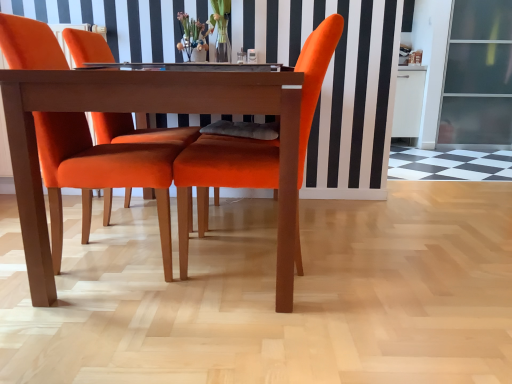
Question: Considering the relative positions of transparent glass screen door at right and translucent glass vase at center in the image provided, is transparent glass screen door at right to the right of translucent glass vase at center from the viewer's perspective?

Choices:
 (A) no
 (B) yes

Answer: (B)

Question: From a real-world perspective, is transparent glass screen door at right positioned under translucent glass vase at center based on gravity?

Choices:
 (A) yes
 (B) no

Answer: (A)

Question: Would you say translucent glass vase at center is part of transparent glass screen door at right's contents?

Choices:
 (A) no
 (B) yes

Answer: (A)

Question: Are transparent glass screen door at right and translucent glass vase at center located far from each other?

Choices:
 (A) yes
 (B) no

Answer: (A)

Question: Does transparent glass screen door at right have a larger size compared to translucent glass vase at center?

Choices:
 (A) yes
 (B) no

Answer: (A)

Question: Considering the relative positions of clear glass table at center and transparent glass screen door at right in the image provided, is clear glass table at center to the left or to the right of transparent glass screen door at right?

Choices:
 (A) right
 (B) left

Answer: (B)

Question: Considering the positions of point pos(156,64) and point pos(450,125), is point pos(156,64) closer or farther from the camera than point pos(450,125)?

Choices:
 (A) farther
 (B) closer

Answer: (B)

Question: Is clear glass table at center situated inside transparent glass screen door at right or outside?

Choices:
 (A) outside
 (B) inside

Answer: (A)

Question: Is clear glass table at center bigger or smaller than transparent glass screen door at right?

Choices:
 (A) big
 (B) small

Answer: (B)

Question: Looking at the image, does wooden table at center seem bigger or smaller compared to transparent glass screen door at right?

Choices:
 (A) small
 (B) big

Answer: (A)

Question: From a real-world perspective, is wooden table at center above or below transparent glass screen door at right?

Choices:
 (A) above
 (B) below

Answer: (B)

Question: Would you say wooden table at center is to the left or to the right of transparent glass screen door at right in the picture?

Choices:
 (A) right
 (B) left

Answer: (B)

Question: Choose the correct answer: Is wooden table at center inside transparent glass screen door at right or outside it?

Choices:
 (A) inside
 (B) outside

Answer: (B)

Question: Looking at the image, does translucent glass vase at center seem bigger or smaller compared to velvet orange chair at center, arranged as the second chair when viewed from the right?

Choices:
 (A) small
 (B) big

Answer: (A)

Question: Is point (188, 59) closer or farther from the camera than point (163, 201)?

Choices:
 (A) farther
 (B) closer

Answer: (A)